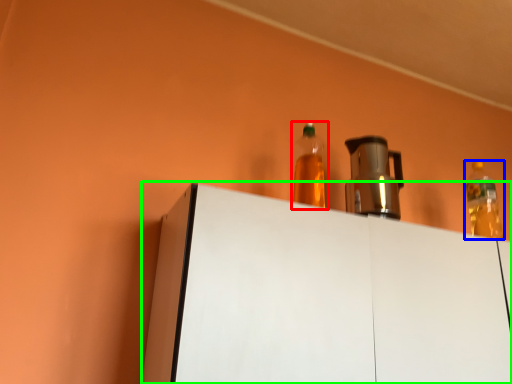
Question: Which object is the farthest from bottle (highlighted by a red box)? Choose among these: bottle (highlighted by a blue box) or furniture (highlighted by a green box).

Choices:
 (A) bottle
 (B) furniture

Answer: (A)